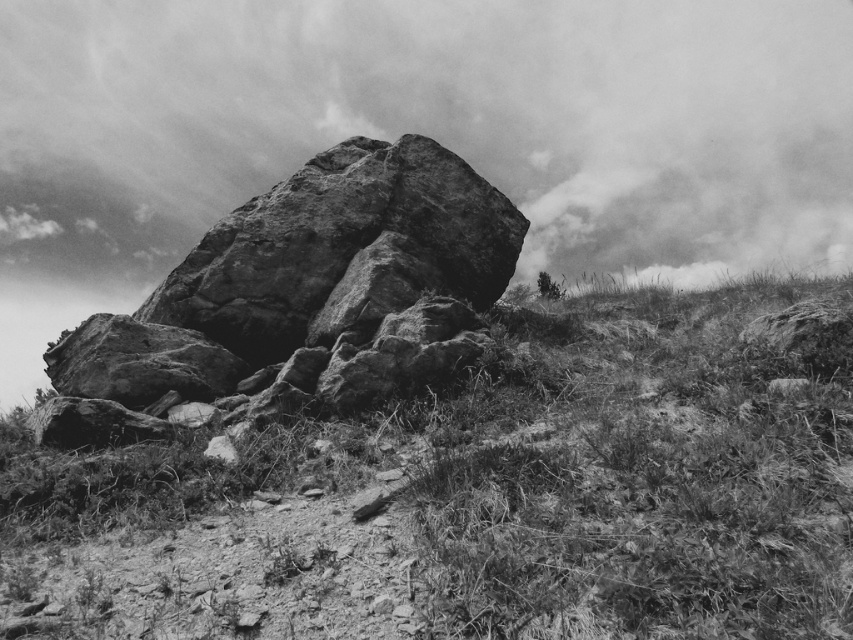
Question: Does cloudy sky at upper center appear over rough textured rock at center?

Choices:
 (A) no
 (B) yes

Answer: (B)

Question: Is fuzzy green grass at center to the left of cloudy sky at upper center from the viewer's perspective?

Choices:
 (A) yes
 (B) no

Answer: (B)

Question: Which object appears closest to the camera in this image?

Choices:
 (A) rough textured rock at center
 (B) fuzzy green grass at center

Answer: (B)

Question: Which point appears farthest from the camera in this image?

Choices:
 (A) (427, 464)
 (B) (751, 93)
 (C) (222, 385)

Answer: (B)

Question: Does fuzzy green grass at center come behind cloudy sky at upper center?

Choices:
 (A) no
 (B) yes

Answer: (A)

Question: Considering the real-world distances, which object is closest to the fuzzy green grass at center?

Choices:
 (A) rough textured rock at center
 (B) cloudy sky at upper center

Answer: (A)